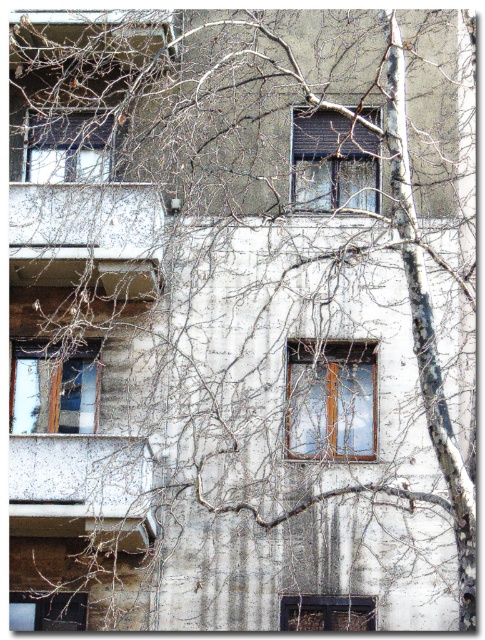
Is clear glass window at center below wooden window at lower center?

Actually, clear glass window at center is above wooden window at lower center.

This screenshot has height=640, width=485. I want to click on clear glass window at center, so click(330, 401).

Can you confirm if matte black window at center is thinner than wooden frame window at upper center?

Yes.

This screenshot has width=485, height=640. Describe the element at coordinates (333, 163) in the screenshot. I see `matte black window at center` at that location.

Describe the element at coordinates (333, 163) in the screenshot. I see `matte black window at center` at that location.

The height and width of the screenshot is (640, 485). Identify the location of matte black window at center. (333, 163).

Measure the distance between point (300, 387) and camera.

Point (300, 387) and camera are 116.07 feet apart.

Is clear glass window at center thinner than transparent glass window at lower left?

In fact, clear glass window at center might be wider than transparent glass window at lower left.

You are a GUI agent. You are given a task and a screenshot of the screen. Output one action in this format:
    pyautogui.click(x=<x>, y=<y>)
    Task: Click on the clear glass window at center
    This screenshot has width=485, height=640.
    Given the screenshot: What is the action you would take?
    pyautogui.click(x=330, y=401)

Locate an element on the screen. This screenshot has height=640, width=485. clear glass window at center is located at coordinates (330, 401).